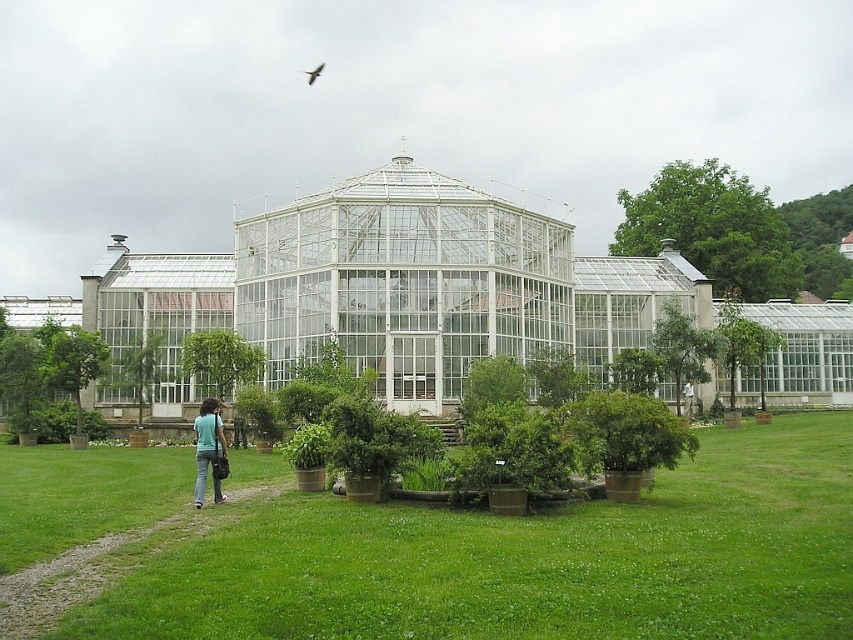
Question: Which object is farther from the camera taking this photo?

Choices:
 (A) green matte potted plants at center
 (B) blue fabric shirt at lower left
 (C) black feathered bird at upper center

Answer: (C)

Question: Which is nearer to the blue fabric shirt at lower left?

Choices:
 (A) transparent glass gazebo at center
 (B) black feathered bird at upper center
 (C) green matte potted plants at center

Answer: (C)

Question: Is green matte potted plants at center to the right of black feathered bird at upper center from the viewer's perspective?

Choices:
 (A) no
 (B) yes

Answer: (B)

Question: Among these points, which one is nearest to the camera?

Choices:
 (A) (683, 483)
 (B) (302, 70)

Answer: (A)

Question: Is blue fabric shirt at lower left thinner than black feathered bird at upper center?

Choices:
 (A) no
 (B) yes

Answer: (A)

Question: Is green matte potted plants at center behind transparent glass gazebo at center?

Choices:
 (A) yes
 (B) no

Answer: (B)